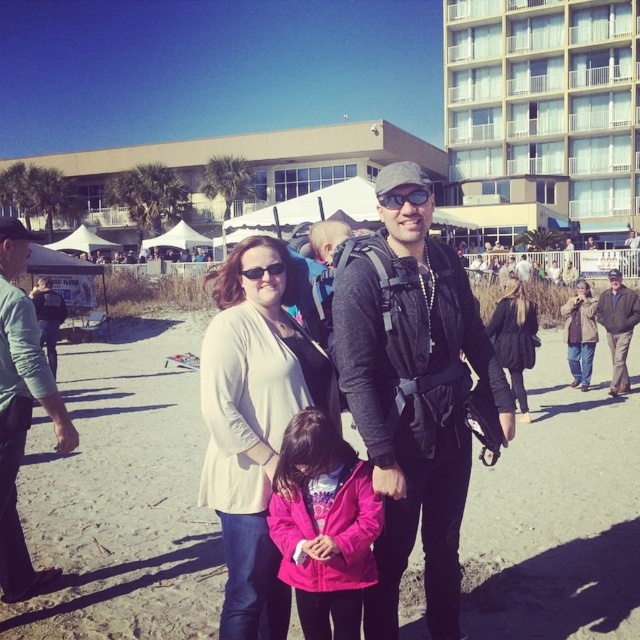
Which of these two, black matte jacket at center or clear plastic goggles at center, stands taller?

Standing taller between the two is black matte jacket at center.

The image size is (640, 640). Identify the location of black matte jacket at center. (413, 401).

Is black matte jacket at center further to camera compared to pink matte jacket at center?

Yes, it is.

Looking at this image, who is shorter, black matte jacket at center or pink matte jacket at center?

pink matte jacket at center is shorter.

Is point (378, 376) positioned after point (332, 605)?

Yes.

This screenshot has width=640, height=640. I want to click on black matte jacket at center, so click(413, 401).

The image size is (640, 640). Find the location of `beige concrete building at upper center`. beige concrete building at upper center is located at coordinates (545, 108).

Can you confirm if beige concrete building at upper center is positioned below khaki cotton jacket at right?

Incorrect, beige concrete building at upper center is not positioned below khaki cotton jacket at right.

Locate an element on the screen. This screenshot has height=640, width=640. beige concrete building at upper center is located at coordinates (545, 108).